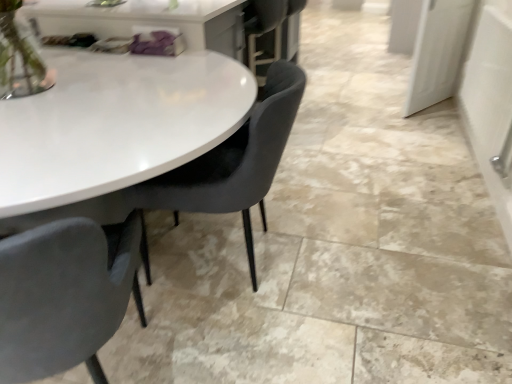
Image resolution: width=512 pixels, height=384 pixels. I want to click on unoccupied space behind matte black chair at center, acting as the 2th chair starting from the left, so click(x=271, y=199).